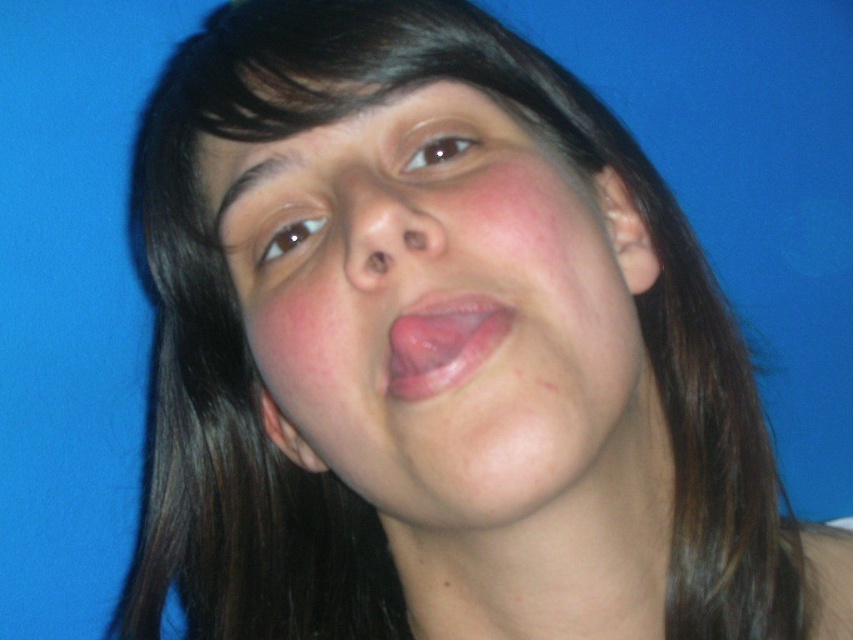
Can you confirm if smooth skin face at center is shorter than pink flesh at center?

In fact, smooth skin face at center may be taller than pink flesh at center.

Which is in front, point (390, 408) or point (434, 336)?

Point (434, 336) is more forward.

Find the location of a particular element. Image resolution: width=853 pixels, height=640 pixels. smooth skin face at center is located at coordinates (444, 314).

Looking at this image, does smooth skin face at center appear on the right side of smooth skin nose at center?

Indeed, smooth skin face at center is positioned on the right side of smooth skin nose at center.

Is point (485, 525) positioned before point (399, 236)?

No, it is not.

Between point (538, 307) and point (370, 170), which one is positioned behind?

The point (370, 170) is behind.

Identify the location of smooth skin face at center. (444, 314).

Is point (434, 232) farther from camera compared to point (399, 380)?

No, (434, 232) is in front of (399, 380).

Where is `smooth skin nose at center`? smooth skin nose at center is located at coordinates (389, 224).